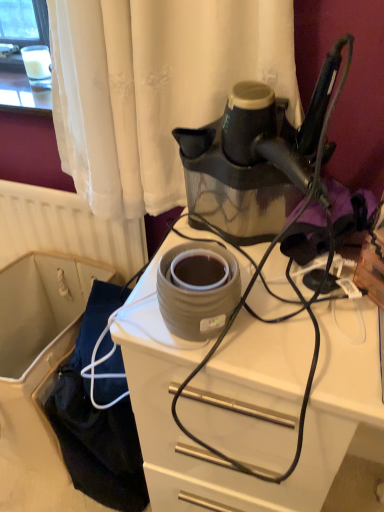
Question: Is matte gray ceramic at center thinner than black rubber cord at center?

Choices:
 (A) no
 (B) yes

Answer: (A)

Question: Can you confirm if matte gray ceramic at center is wider than black rubber cord at center?

Choices:
 (A) yes
 (B) no

Answer: (A)

Question: Is matte gray ceramic at center smaller than black rubber cord at center?

Choices:
 (A) no
 (B) yes

Answer: (A)

Question: Does matte gray ceramic at center have a lesser height compared to black rubber cord at center?

Choices:
 (A) no
 (B) yes

Answer: (A)

Question: Can you confirm if matte gray ceramic at center is taller than black rubber cord at center?

Choices:
 (A) no
 (B) yes

Answer: (B)

Question: Considering the positions of point (278, 238) and point (276, 495), is point (278, 238) closer or farther from the camera than point (276, 495)?

Choices:
 (A) closer
 (B) farther

Answer: (A)

Question: Is black rubber cord at center bigger or smaller than matte gray ceramic at center?

Choices:
 (A) small
 (B) big

Answer: (A)

Question: From a real-world perspective, is black rubber cord at center positioned above or below matte gray ceramic at center?

Choices:
 (A) above
 (B) below

Answer: (A)

Question: Relative to matte gray ceramic at center, is black rubber cord at center in front or behind?

Choices:
 (A) front
 (B) behind

Answer: (A)

Question: Choose the correct answer: Is black rubber cord at center inside matte gray ceramic pot at center or outside it?

Choices:
 (A) outside
 (B) inside

Answer: (A)

Question: From a real-world perspective, is black rubber cord at center physically located above or below matte gray ceramic pot at center?

Choices:
 (A) below
 (B) above

Answer: (B)

Question: In terms of height, does black rubber cord at center look taller or shorter compared to matte gray ceramic pot at center?

Choices:
 (A) tall
 (B) short

Answer: (A)

Question: Is black rubber cord at center wider or thinner than matte gray ceramic pot at center?

Choices:
 (A) wide
 (B) thin

Answer: (A)

Question: Considering the positions of point (213, 328) and point (345, 343), is point (213, 328) closer or farther from the camera than point (345, 343)?

Choices:
 (A) farther
 (B) closer

Answer: (A)

Question: From a real-world perspective, is matte gray ceramic pot at center above or below matte gray ceramic at center?

Choices:
 (A) below
 (B) above

Answer: (B)